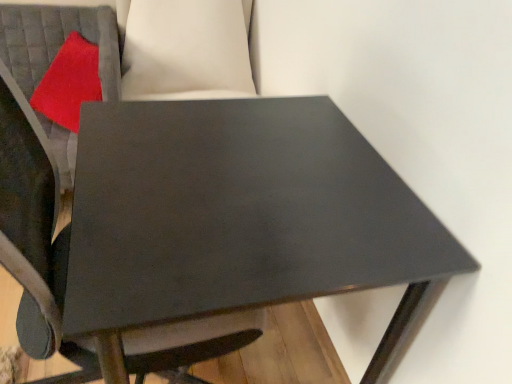
Where is `empty space that is ontop of matte black table at center (from a real-world perspective)`? The image size is (512, 384). empty space that is ontop of matte black table at center (from a real-world perspective) is located at coordinates (234, 187).